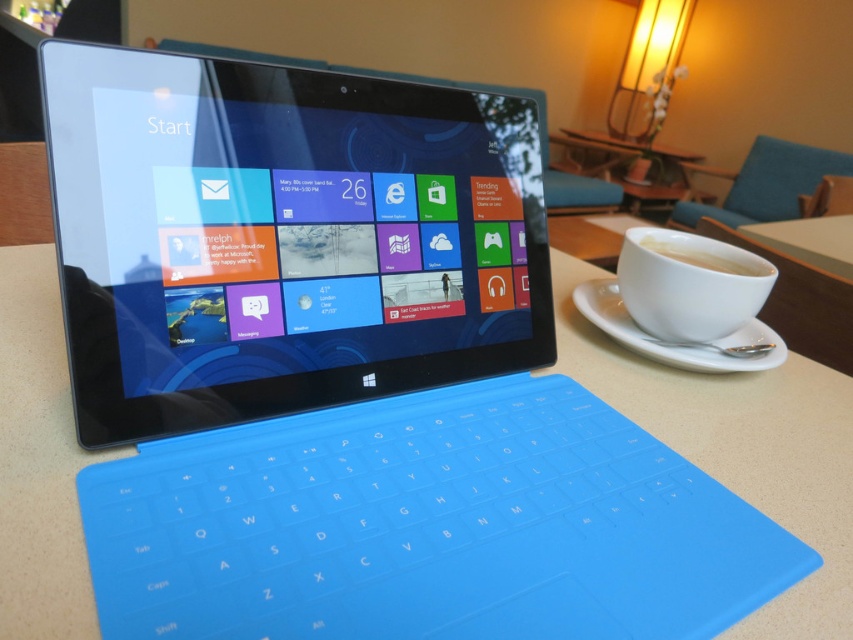
You are a barista preparing a customer order. You have a white matte cup at right and a white ceramic saucer at right on the table. Which item should you use to place under the cup to prevent spills?

The white ceramic saucer at right should be placed under the white matte cup at right because it is taller and can better catch spills.

You are trying to place the white matte cup at right on the white ceramic saucer at right. Will it fit?

The white ceramic saucer at right is larger in size than white matte cup at right, so yes, the white matte cup at right will fit on the white ceramic saucer at right.

You are holding a 20 inch ruler and want to measure the distance between the point at coordinates (679, 349) and yourself. Can you fit the ruler to measure this distance?

The distance between the point at coordinates (679, 349) and the viewer is 21.89 inches. Since the ruler is only 20 inches long, it is not long enough to measure the distance. You will need a longer ruler.